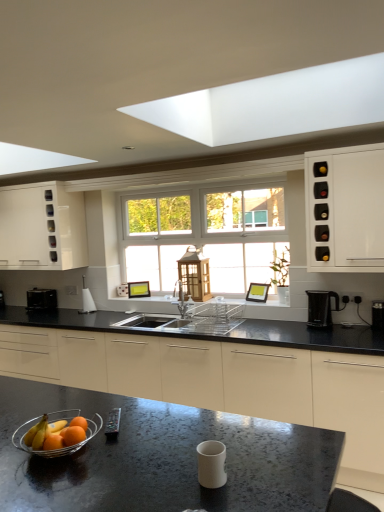
At what (x,y) coordinates should I click in order to perform the action: click on vacant point to the right of white matte cup at center, the fourth appliance positioned from the left. Please return your answer as a coordinate pair (x, y). The height and width of the screenshot is (512, 384). Looking at the image, I should click on (274, 472).